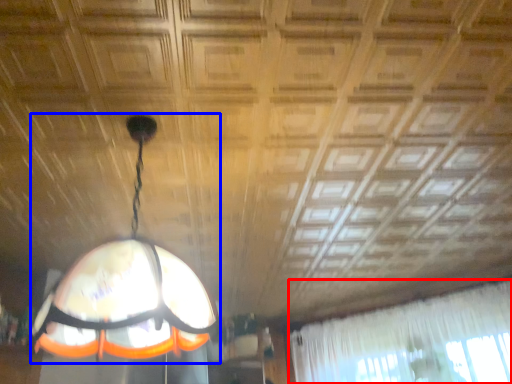
Question: Which point is closer to the camera, curtain (highlighted by a red box) or lamp (highlighted by a blue box)?

Choices:
 (A) curtain
 (B) lamp

Answer: (B)